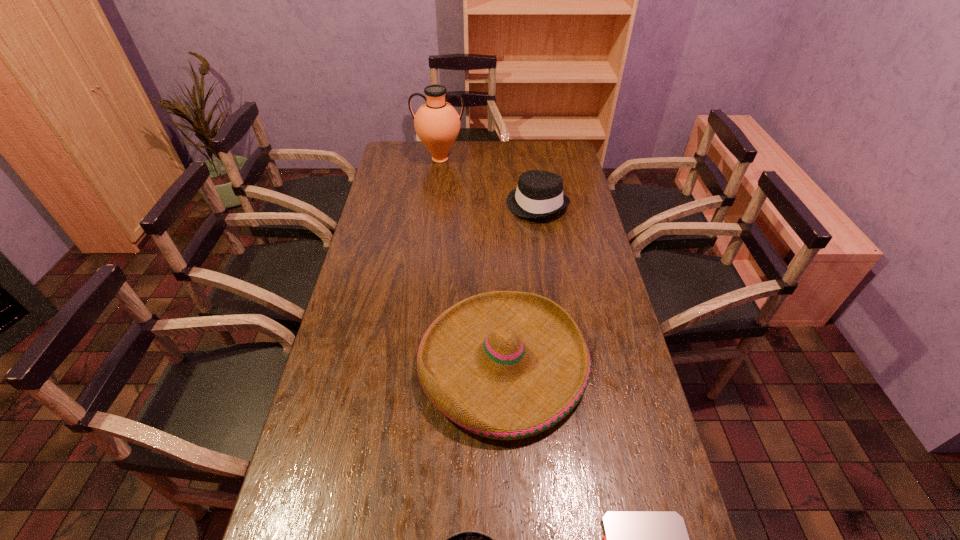
Where is `sombrero present at the right edge`? sombrero present at the right edge is located at coordinates (506, 365).

Find the location of a particular element. object that is at the far left corner is located at coordinates (437, 123).

You are a GUI agent. You are given a task and a screenshot of the screen. Output one action in this format:
    pyautogui.click(x=<x>, y=<y>)
    Task: Click on the free space at the far edge
    The width and height of the screenshot is (960, 540).
    Given the screenshot: What is the action you would take?
    pyautogui.click(x=434, y=165)

Find the location of `vacant region at the left edge of the desktop`. vacant region at the left edge of the desktop is located at coordinates (381, 177).

Identify the location of vacant space at the right edge. (588, 266).

The height and width of the screenshot is (540, 960). In the image, there is a desktop. What are the coordinates of `blank space at the far left corner` in the screenshot? It's located at (409, 147).

Locate an element on the screen. The width and height of the screenshot is (960, 540). vacant space at the far right corner of the desktop is located at coordinates click(542, 164).

The width and height of the screenshot is (960, 540). I want to click on blank region between the pitcher and the sombrero, so coord(471,261).

Image resolution: width=960 pixels, height=540 pixels. In order to click on empty space that is in between the farthest object and the third nearest object in this screenshot , I will do `click(471, 261)`.

Locate an element on the screen. object that is the fourth nearest to the farthest object is located at coordinates (466, 539).